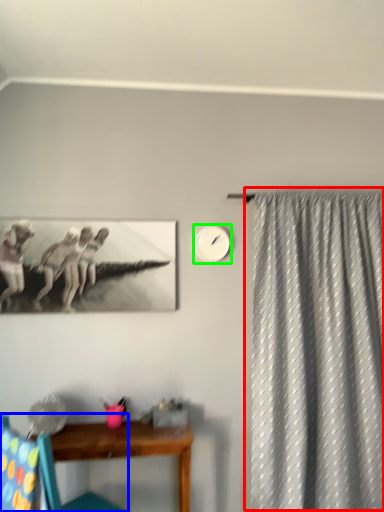
Question: Estimate the real-world distances between objects in this image. Which object is farther from curtain (highlighted by a red box), chair (highlighted by a blue box) or clock (highlighted by a green box)?

Choices:
 (A) chair
 (B) clock

Answer: (A)